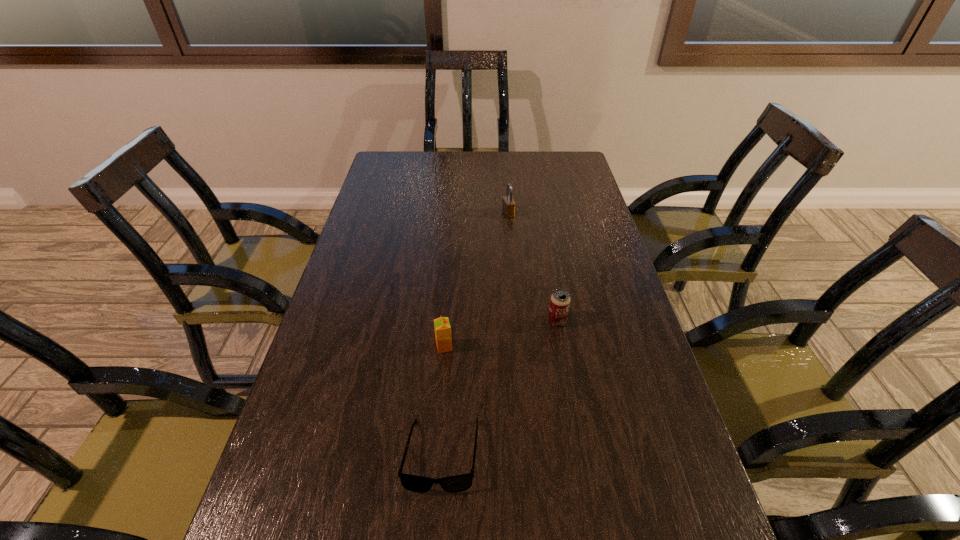
At what (x,y) coordinates should I click in order to perform the action: click on vacant space located 0.070m on the front-facing side of the shortest object. Please return your answer as a coordinate pair (x, y). Looking at the image, I should click on (436, 537).

At what (x,y) coordinates should I click in order to perform the action: click on vacant region at the far edge of the desktop. Please return your answer as a coordinate pair (x, y). This screenshot has width=960, height=540. Looking at the image, I should click on (420, 164).

The image size is (960, 540). Identify the location of vacant space at the left edge of the desktop. (389, 300).

This screenshot has height=540, width=960. I want to click on free spot at the right edge of the desktop, so click(548, 182).

Image resolution: width=960 pixels, height=540 pixels. What are the coordinates of `free space between the orange juice and the shortest object` in the screenshot? It's located at [x=443, y=401].

I want to click on free area in between the tallest object and the second farthest object, so click(533, 267).

Locate an element on the screen. The image size is (960, 540). free space between the farthest object and the third nearest object is located at coordinates (533, 267).

Image resolution: width=960 pixels, height=540 pixels. I want to click on free space between the third nearest object and the orange juice, so pos(500,334).

The image size is (960, 540). Identify the location of vacant area that lies between the shortest object and the second farthest object. (499, 388).

What are the coordinates of `free point between the shortest object and the orange juice` in the screenshot? It's located at (443, 401).